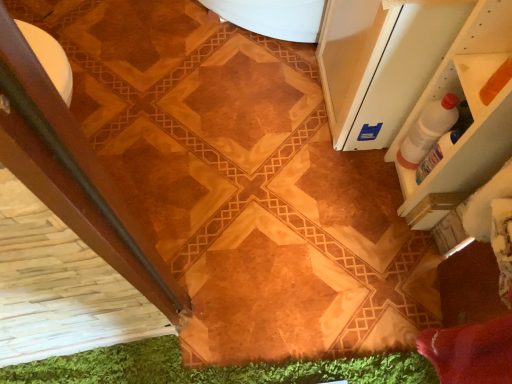
Question: Should I look upward or downward to see white glossy screen door at upper right?

Choices:
 (A) down
 (B) up

Answer: (B)

Question: Is white glossy screen door at upper right outside white plastic bottle at upper right?

Choices:
 (A) no
 (B) yes

Answer: (B)

Question: Considering the relative positions of white glossy screen door at upper right and white plastic bottle at upper right in the image provided, is white glossy screen door at upper right to the left of white plastic bottle at upper right from the viewer's perspective?

Choices:
 (A) yes
 (B) no

Answer: (A)

Question: Considering the relative sizes of white glossy screen door at upper right and white plastic bottle at upper right in the image provided, is white glossy screen door at upper right bigger than white plastic bottle at upper right?

Choices:
 (A) yes
 (B) no

Answer: (A)

Question: Is the position of white glossy screen door at upper right more distant than that of white plastic bottle at upper right?

Choices:
 (A) yes
 (B) no

Answer: (B)

Question: From a real-world perspective, is white glossy screen door at upper right located beneath white plastic bottle at upper right?

Choices:
 (A) yes
 (B) no

Answer: (B)

Question: Does white glossy screen door at upper right have a greater width compared to white plastic bottle at upper right?

Choices:
 (A) yes
 (B) no

Answer: (A)

Question: Can you confirm if white plastic bottle at upper right is smaller than white glossy screen door at upper right?

Choices:
 (A) yes
 (B) no

Answer: (A)

Question: Considering the relative sizes of white plastic bottle at upper right and white glossy screen door at upper right in the image provided, is white plastic bottle at upper right wider than white glossy screen door at upper right?

Choices:
 (A) yes
 (B) no

Answer: (B)

Question: Is white plastic bottle at upper right shorter than white glossy screen door at upper right?

Choices:
 (A) yes
 (B) no

Answer: (A)

Question: Is white plastic bottle at upper right further to camera compared to white glossy screen door at upper right?

Choices:
 (A) yes
 (B) no

Answer: (A)

Question: Is white glossy screen door at upper right inside white plastic bottle at upper right?

Choices:
 (A) no
 (B) yes

Answer: (A)

Question: Is white plastic bottle at upper right not within white glossy screen door at upper right?

Choices:
 (A) no
 (B) yes

Answer: (B)

Question: From the image's perspective, is white plastic bottle at upper right above or below white glossy screen door at upper right?

Choices:
 (A) above
 (B) below

Answer: (B)